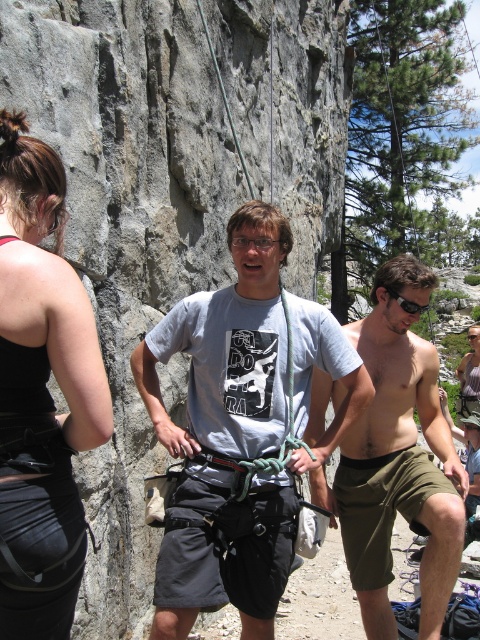
You are a photographer trying to capture a candid shot of the climber in the center. You notice the gray fabric shirt at center and the shiny metallic shorts at center. Which clothing item would be more challenging to focus on due to its size?

The gray fabric shirt at center has a larger width than the shiny metallic shorts at center, making it more challenging to focus on due to its size.

You are a safety inspector assessing the climbing area. The safety guidelines state that the minimum safe distance between climbers and the rock cliff should be at least 50 feet to prevent accidents. Based on the scene, is the distance between the gray rock cliff at center and the gray fabric shirt at center compliant with the safety guidelines?

The gray rock cliff at center is 40.85 feet from the gray fabric shirt at center, which is less than the required 50 feet. Therefore, the distance does not comply with the safety guidelines.